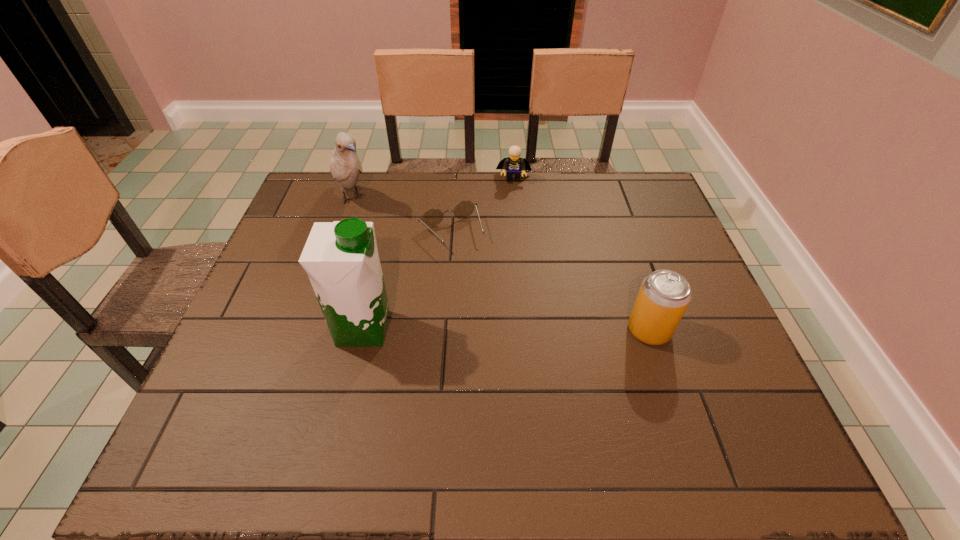
The image size is (960, 540). I want to click on soya milk, so click(x=341, y=258).

Where is `the rightmost object`? This screenshot has height=540, width=960. the rightmost object is located at coordinates (664, 295).

The image size is (960, 540). Find the location of `the third tallest object`. the third tallest object is located at coordinates coord(664,295).

Identify the location of the shortest object. This screenshot has width=960, height=540. (433, 217).

You are a GUI agent. You are given a task and a screenshot of the screen. Output one action in this format:
    pyautogui.click(x=<x>, y=<y>)
    Task: Click on the third object from left to right
    The width and height of the screenshot is (960, 540).
    Given the screenshot: What is the action you would take?
    pyautogui.click(x=433, y=217)

This screenshot has width=960, height=540. In order to click on the fourth shortest object in this screenshot , I will do `click(345, 166)`.

Locate an element on the screen. the fourth tallest object is located at coordinates (512, 165).

The width and height of the screenshot is (960, 540). What are the coordinates of `Lego` in the screenshot? It's located at (512, 165).

Locate an element on the screen. free region located 0.370m on the front-facing side of the soya milk is located at coordinates (552, 328).

The height and width of the screenshot is (540, 960). Identify the location of vacant space located on the left of the rightmost object. (511, 330).